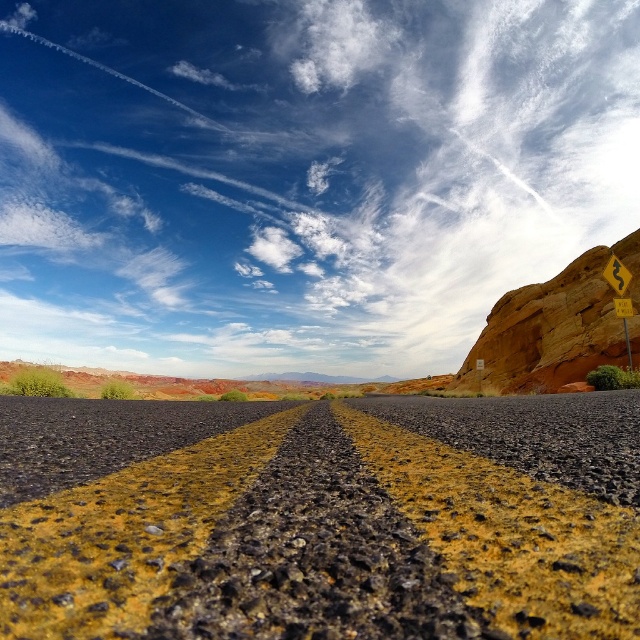
Question: Which object appears closest to the camera in this image?

Choices:
 (A) yellow matte road sign at right
 (B) yellow plastic road sign at right
 (C) black asphalt road at center
 (D) rustic stone mountain at right

Answer: (C)

Question: Which point is closer to the camera?

Choices:
 (A) yellow plastic road sign at right
 (B) rustic stone mountain at right
 (C) yellow matte road sign at right

Answer: (A)

Question: In this image, where is rustic stone mountain at right located relative to yellow matte road sign at right?

Choices:
 (A) below
 (B) above

Answer: (A)

Question: Is the position of black asphalt road at center more distant than that of rustic stone mountain at right?

Choices:
 (A) no
 (B) yes

Answer: (A)

Question: Among these points, which one is farthest from the camera?

Choices:
 (A) (625, 276)
 (B) (390, 444)
 (C) (570, 321)
 (D) (616, 275)

Answer: (C)

Question: Is yellow plastic road sign at right smaller than yellow matte road sign at right?

Choices:
 (A) yes
 (B) no

Answer: (B)